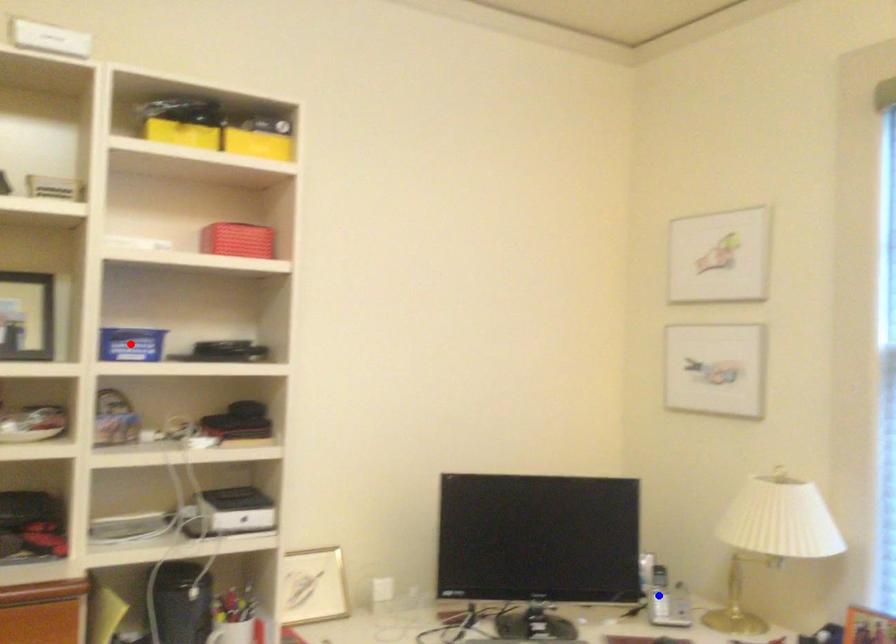
Question: Which of the two points in the image is closer to the camera?

Choices:
 (A) Blue point is closer.
 (B) Red point is closer.

Answer: (B)